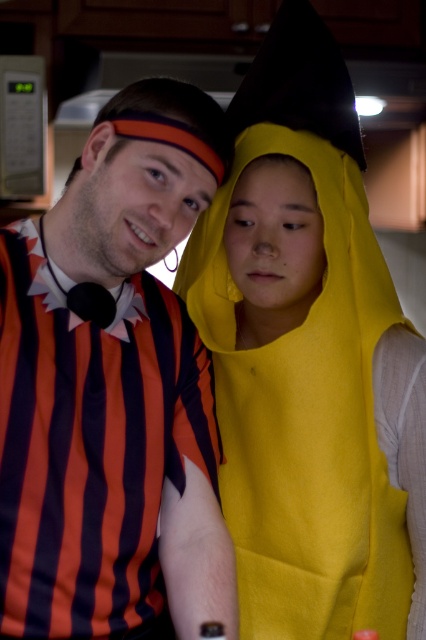
Question: Can you confirm if yellow felt costume at center is positioned above matte striped shirt at left?

Choices:
 (A) yes
 (B) no

Answer: (A)

Question: Among these objects, which one is nearest to the camera?

Choices:
 (A) yellow felt costume at center
 (B) matte striped shirt at left

Answer: (B)

Question: Which of the following is the closest to the observer?

Choices:
 (A) matte striped shirt at left
 (B) yellow felt costume at center

Answer: (A)

Question: Can you confirm if yellow felt costume at center is positioned to the left of matte striped shirt at left?

Choices:
 (A) no
 (B) yes

Answer: (A)

Question: Does yellow felt costume at center have a greater width compared to matte striped shirt at left?

Choices:
 (A) yes
 (B) no

Answer: (A)